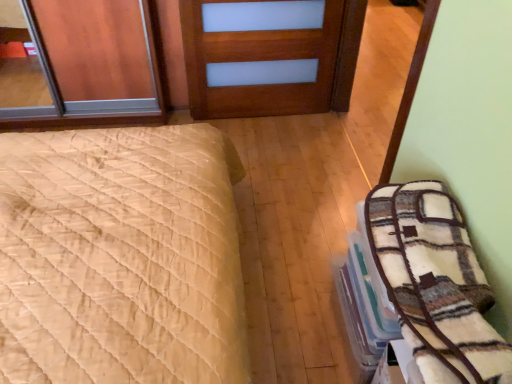
Question: Is plush white blanket at right to the left of wooden door at center from the viewer's perspective?

Choices:
 (A) yes
 (B) no

Answer: (B)

Question: Does plush white blanket at right have a lesser width compared to wooden door at center?

Choices:
 (A) yes
 (B) no

Answer: (B)

Question: Does plush white blanket at right have a smaller size compared to wooden door at center?

Choices:
 (A) no
 (B) yes

Answer: (B)

Question: Is plush white blanket at right shorter than wooden door at center?

Choices:
 (A) no
 (B) yes

Answer: (B)

Question: Is there a large distance between plush white blanket at right and wooden door at center?

Choices:
 (A) no
 (B) yes

Answer: (B)

Question: From the image's perspective, is plush white blanket at right on wooden door at center?

Choices:
 (A) yes
 (B) no

Answer: (B)

Question: From the image's perspective, does wooden door at center appear higher than plush white blanket at right?

Choices:
 (A) no
 (B) yes

Answer: (B)

Question: From a real-world perspective, is wooden door at center positioned over plush white blanket at right based on gravity?

Choices:
 (A) yes
 (B) no

Answer: (B)

Question: Is wooden door at center thinner than plush white blanket at right?

Choices:
 (A) no
 (B) yes

Answer: (B)

Question: Does wooden door at center lie behind plush white blanket at right?

Choices:
 (A) no
 (B) yes

Answer: (B)

Question: Is wooden door at center shorter than plush white blanket at right?

Choices:
 (A) yes
 (B) no

Answer: (B)

Question: Is wooden door at center facing away from plush white blanket at right?

Choices:
 (A) yes
 (B) no

Answer: (B)

Question: Considering the relative positions of plush white blanket at right and beige quilted bed at left in the image provided, is plush white blanket at right in front of beige quilted bed at left?

Choices:
 (A) yes
 (B) no

Answer: (B)